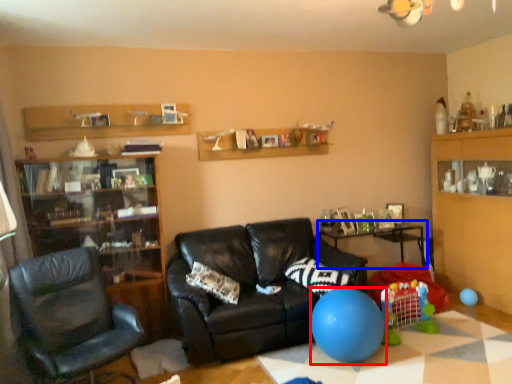
Question: Which object is closer to the camera taking this photo, balloon (highlighted by a red box) or table (highlighted by a blue box)?

Choices:
 (A) balloon
 (B) table

Answer: (A)